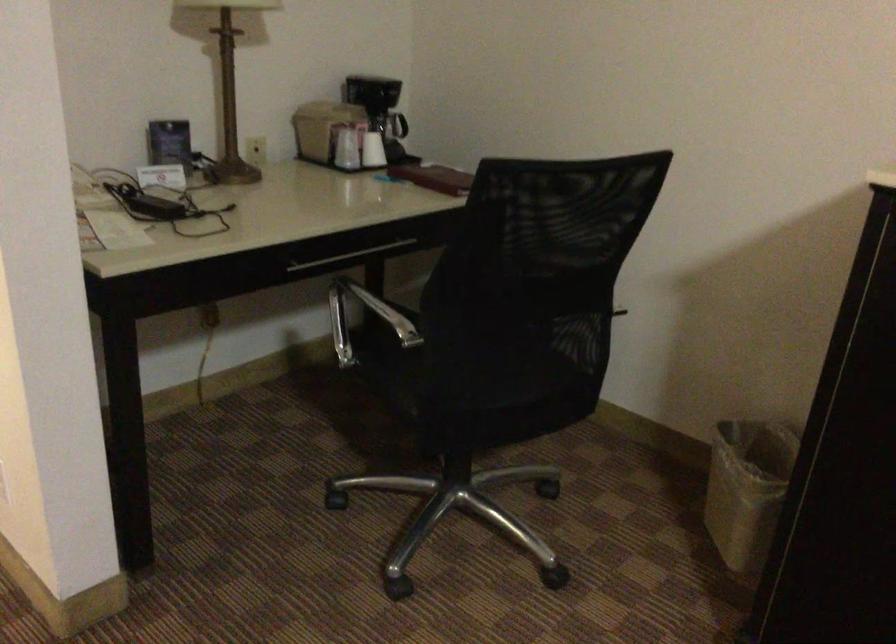
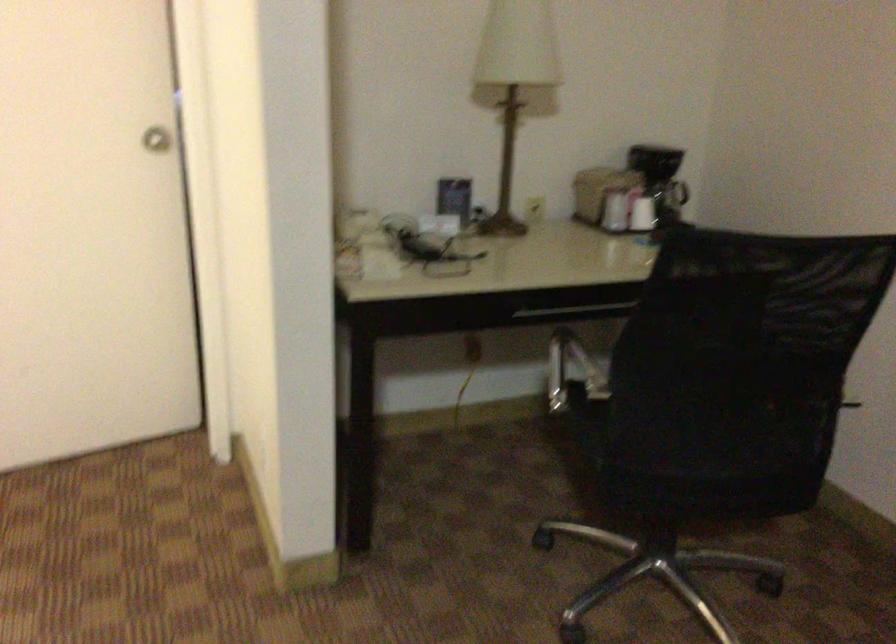
Question: In a continuous first-person perspective shot, in which direction is the camera moving?

Choices:
 (A) Left
 (B) Right
 (C) Forward
 (D) Backward

Answer: (B)